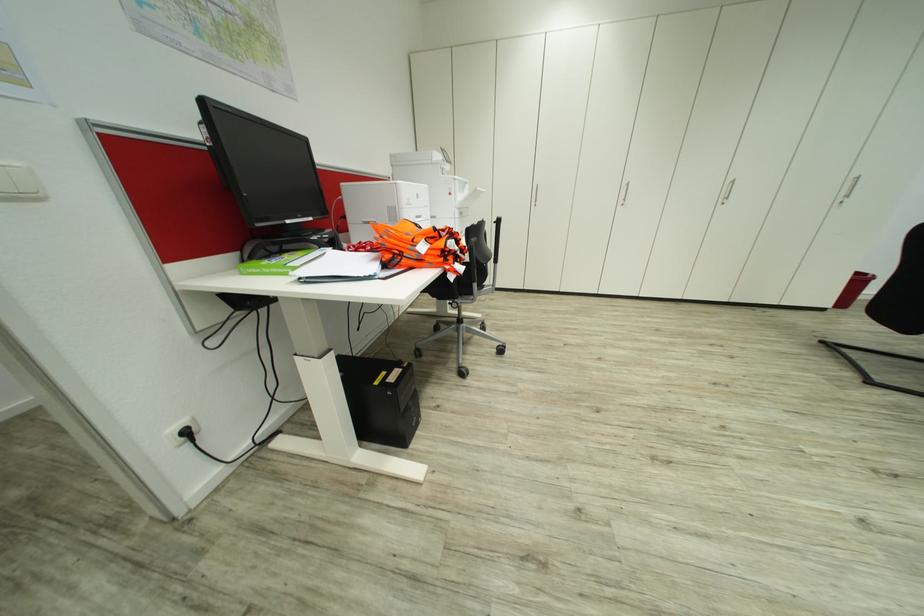
This screenshot has height=616, width=924. Find the location of `white light switch`. white light switch is located at coordinates (19, 182).